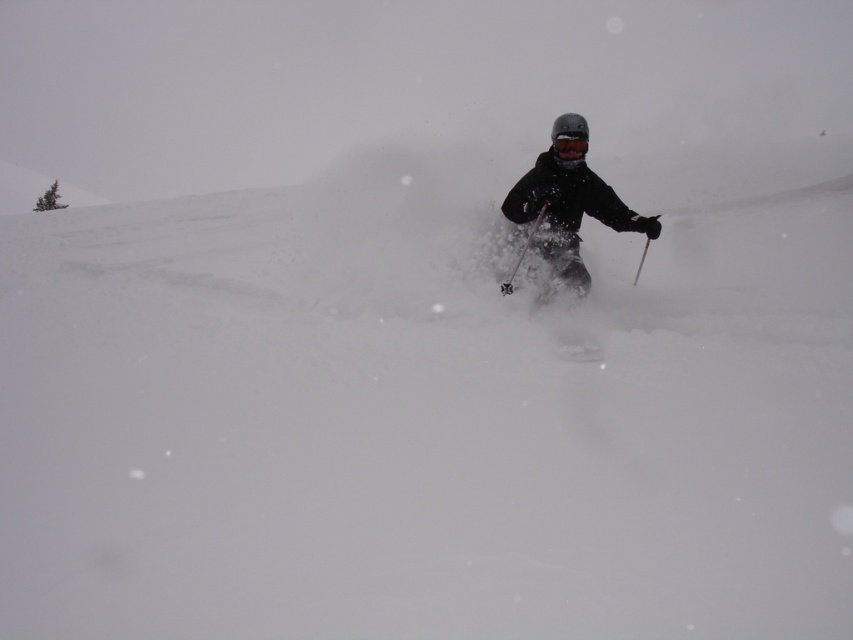
Question: Which object is the farthest from the matte black ski suit at center?

Choices:
 (A) metallic silver ski pole at center
 (B) transparent plastic goggles at center

Answer: (B)

Question: Is matte black ski suit at center to the right of metallic silver ski pole at center from the viewer's perspective?

Choices:
 (A) yes
 (B) no

Answer: (A)

Question: Which object appears farthest from the camera in this image?

Choices:
 (A) transparent plastic goggles at center
 (B) matte black ski suit at center

Answer: (A)

Question: Is matte black ski suit at center bigger than transparent plastic goggles at center?

Choices:
 (A) no
 (B) yes

Answer: (B)

Question: Which of the following is the closest to the observer?

Choices:
 (A) (555, 150)
 (B) (512, 275)
 (C) (564, 268)

Answer: (B)

Question: From the image, what is the correct spatial relationship of matte black ski suit at center in relation to transparent plastic goggles at center?

Choices:
 (A) above
 (B) below

Answer: (B)